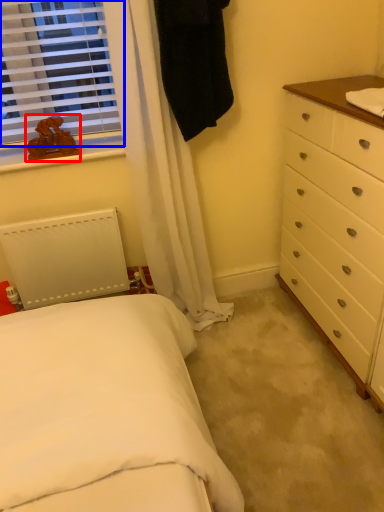
Question: Among these objects, which one is nearest to the camera, toy (highlighted by a red box) or window (highlighted by a blue box)?

Choices:
 (A) toy
 (B) window

Answer: (B)